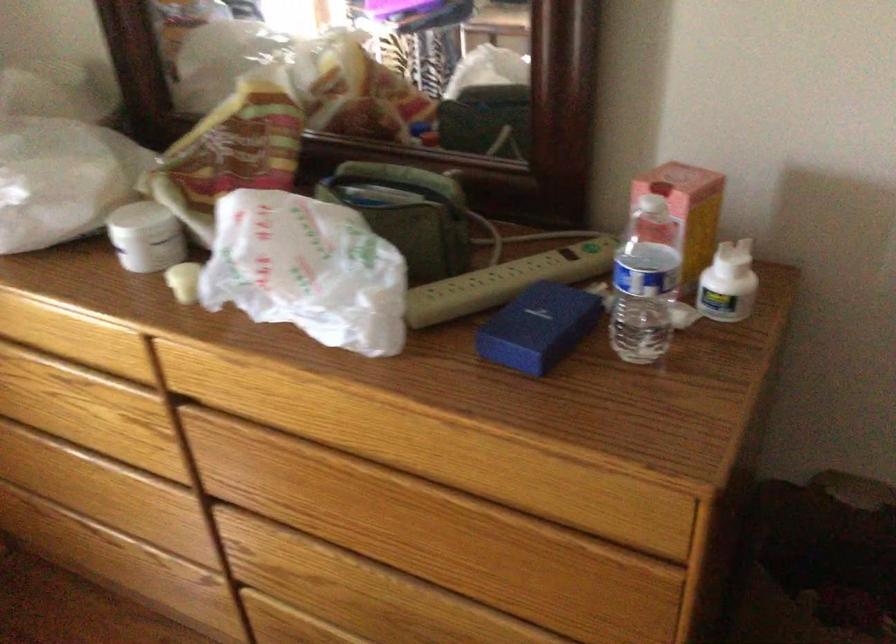
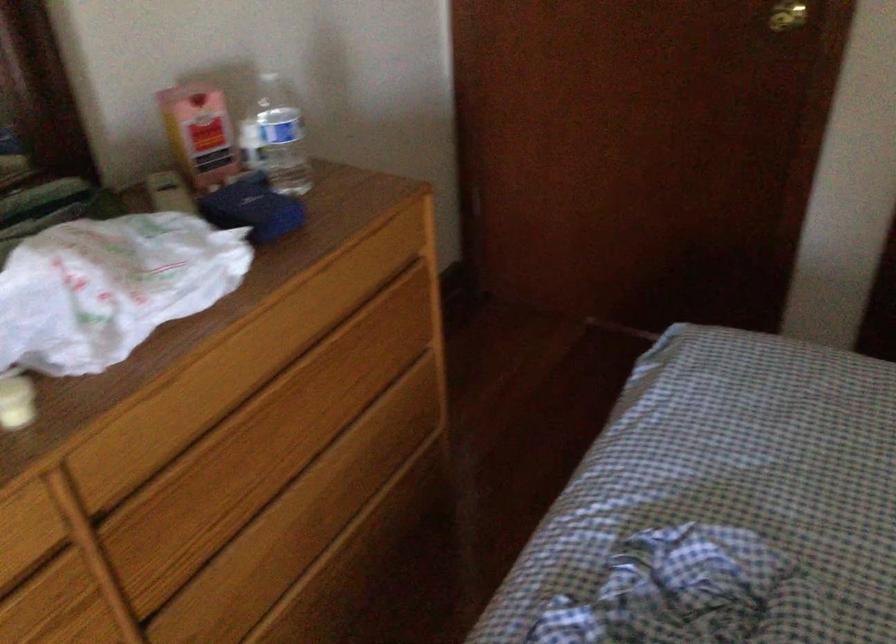
Find the pixel in the second image that matches (616,274) in the first image.

(276, 138)